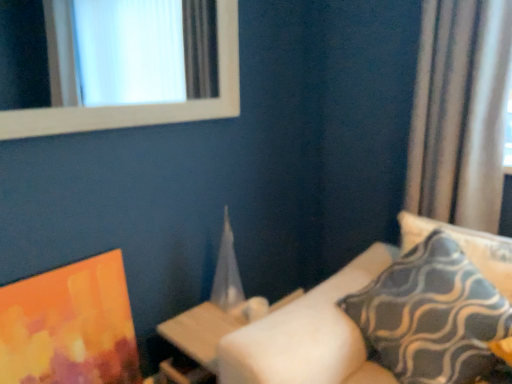
Question: Is patterned fabric pillow at right, which is counted as the 2th pillow, starting from the right, in front of or behind matte orange painting at lower left in the image?

Choices:
 (A) behind
 (B) front

Answer: (B)

Question: From a real-world perspective, is patterned fabric pillow at right, which is counted as the 2th pillow, starting from the right, physically located above or below matte orange painting at lower left?

Choices:
 (A) below
 (B) above

Answer: (B)

Question: Based on their relative distances, which object is farther from the silky beige curtain at right?

Choices:
 (A) blue-patterned fabric pillow at right, arranged as the first pillow when viewed from the right
 (B) patterned fabric pillow at right, which is counted as the 2th pillow, starting from the right
 (C) wooden table at center
 (D) white wooden frame at upper left
 (E) matte orange painting at lower left

Answer: (E)

Question: Based on their relative distances, which object is nearer to the patterned fabric pillow at right, which is counted as the 2th pillow, starting from the right?

Choices:
 (A) matte orange painting at lower left
 (B) blue-patterned fabric pillow at right, positioned as the second pillow in left-to-right order
 (C) silky beige curtain at right
 (D) wooden table at center
 (E) white wooden frame at upper left

Answer: (B)